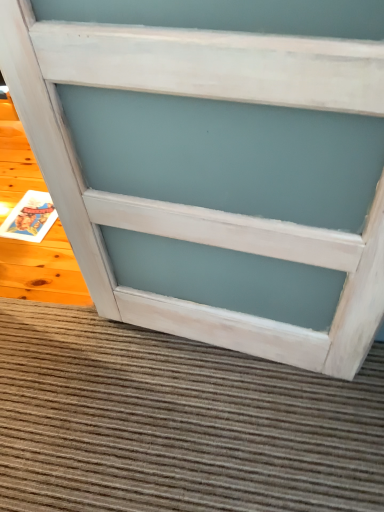
The height and width of the screenshot is (512, 384). What are the coordinates of `vacant area situated below white painted wood cabinet at lower center (from a real-world perspective)` in the screenshot? It's located at (212, 351).